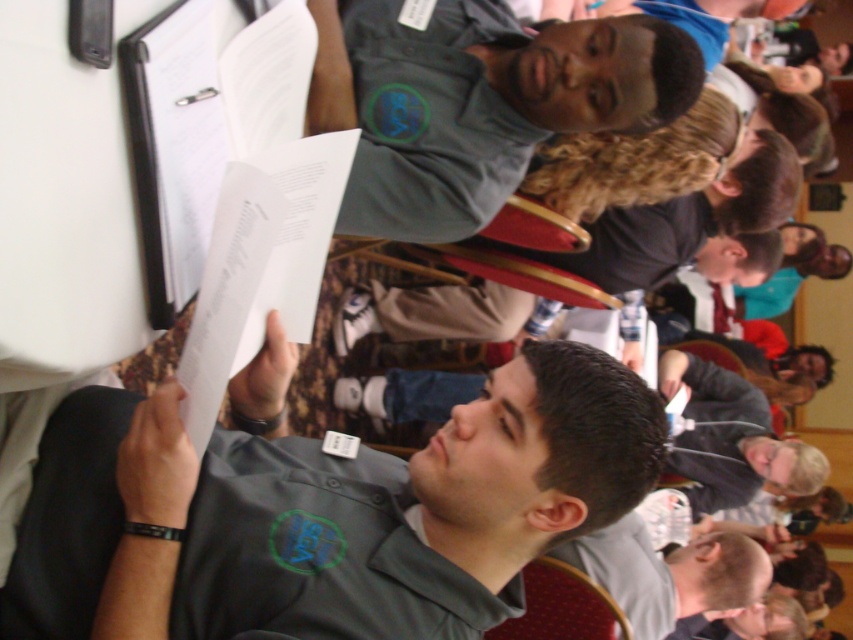
The width and height of the screenshot is (853, 640). What do you see at coordinates (730, 440) in the screenshot?
I see `gray fleece jacket at lower right` at bounding box center [730, 440].

Does point (767, 474) lie behind point (648, 627)?

Yes, it is behind point (648, 627).

Between point (727, 385) and point (711, 593), which one is positioned behind?

The point (727, 385) is behind.

Identify the location of gray fleece jacket at lower right. The width and height of the screenshot is (853, 640). (730, 440).

Does gray fabric shirt at center lie behind gray matte shirt at lower right?

No, gray fabric shirt at center is closer to the viewer.

Between point (233, 582) and point (712, 582), which one is positioned behind?

Point (712, 582)

Find the location of a particular element. gray fabric shirt at center is located at coordinates (323, 513).

You are a GUI agent. You are given a task and a screenshot of the screen. Output one action in this format:
    pyautogui.click(x=<x>, y=<y>)
    Task: Click on the gray fabric shirt at center
    This screenshot has height=640, width=853.
    Given the screenshot: What is the action you would take?
    pyautogui.click(x=323, y=513)

Can you confirm if gray fabric shirt at upper center is wider than dark gray shirt at upper center?

No.

From the picture: Who is more distant from viewer, [578,67] or [618,275]?

The point [618,275] is behind.

This screenshot has height=640, width=853. I want to click on gray fabric shirt at upper center, so click(x=479, y=104).